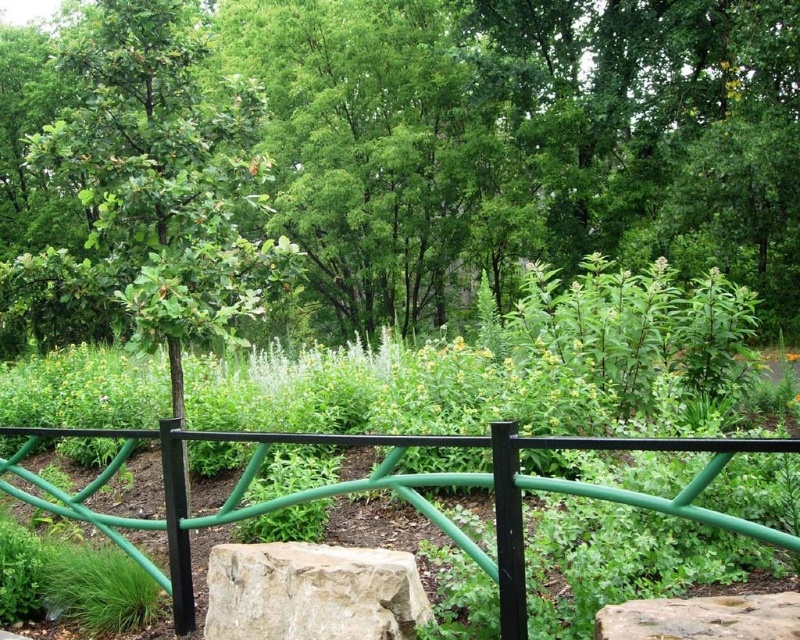
You are standing in the garden and see the green painted metal fence at center and the beige rough stone boulder at center. Which object is positioned to the left when viewed from your perspective?

The green painted metal fence at center is to the left of the beige rough stone boulder at center.

You are standing in the garden and want to take a photo of both the green leafy tree at center and the beige rough stone boulder at center. Which object should you position to your left to include both in the frame?

You should position the green leafy tree at center to your left since it is already on the left side of the beige rough stone boulder at center, ensuring both are included in the frame.

You are a gardener planning to install a new flower bed between the green painted metal fence at center and the beige rough stone boulder at center. Which object should you consider in terms of height when deciding where to place the flower bed?

The green painted metal fence at center is taller than the beige rough stone boulder at center, so you should consider the height of the green painted metal fence at center when deciding where to place the flower bed.